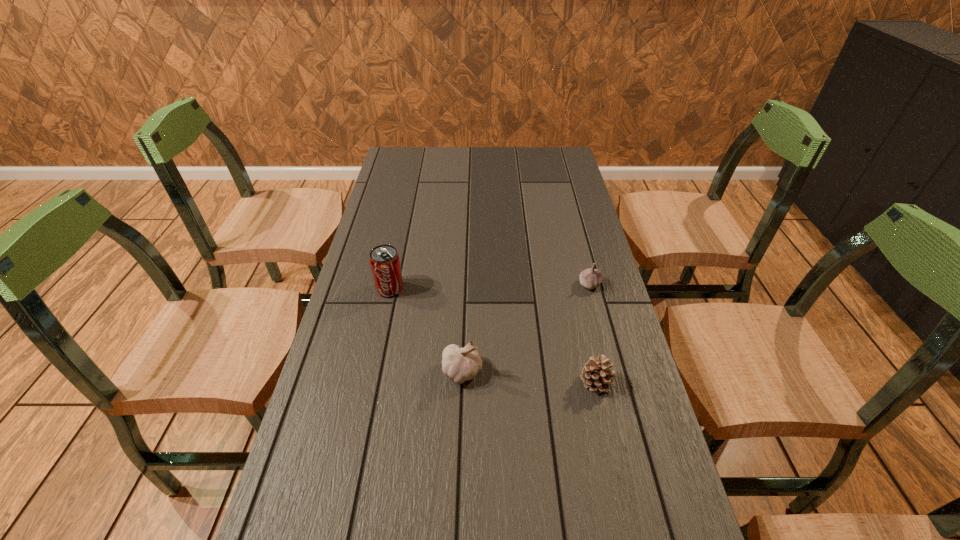
Where is `pop soda`? This screenshot has width=960, height=540. pop soda is located at coordinates (385, 265).

This screenshot has height=540, width=960. In order to click on the nearer garlic in this screenshot , I will do `click(460, 364)`.

Locate an element on the screen. This screenshot has height=540, width=960. the left garlic is located at coordinates [x=460, y=364].

Locate an element on the screen. The width and height of the screenshot is (960, 540). pinecone is located at coordinates (596, 374).

Where is `the farther garlic`? the farther garlic is located at coordinates (590, 278).

Image resolution: width=960 pixels, height=540 pixels. Identify the location of the right garlic. (590, 278).

Identify the location of vacant space located on the right of the pop soda. (534, 288).

Identify the location of vacant area situated on the right of the taller garlic. (637, 372).

Where is `free region located on the left of the pinecone`? free region located on the left of the pinecone is located at coordinates (532, 383).

This screenshot has height=540, width=960. Find the location of `free location located on the back of the shorter garlic`. free location located on the back of the shorter garlic is located at coordinates (579, 244).